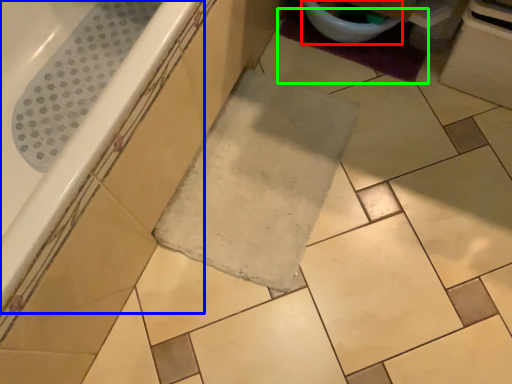
Question: Which object is positioned farthest from toilet bowl (highlighted by a red box)? Select from bathtub (highlighted by a blue box) and bath mat (highlighted by a green box).

Choices:
 (A) bathtub
 (B) bath mat

Answer: (A)